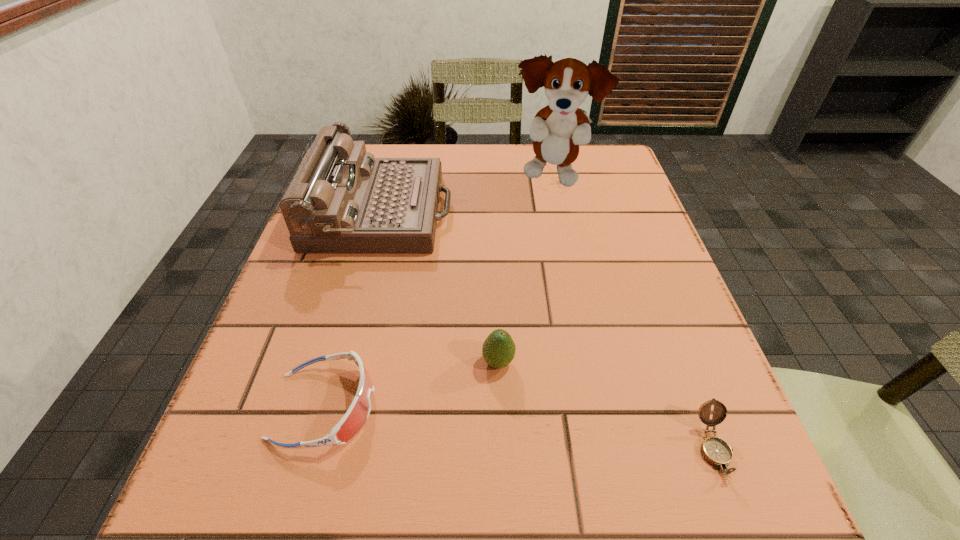
This screenshot has height=540, width=960. Identify the location of vacant space situated on the back of the third object from left to right. (493, 223).

Find the location of a particular element. free spot located on the front-facing side of the goggles is located at coordinates (601, 406).

Locate an element on the screen. The image size is (960, 540). puppy positioned at the far edge is located at coordinates (557, 130).

Locate an element on the screen. This screenshot has width=960, height=540. typewriter located at the far edge is located at coordinates (342, 200).

Locate an element on the screen. This screenshot has height=540, width=960. object situated at the near edge is located at coordinates (716, 451).

I want to click on typewriter situated at the left edge, so click(x=342, y=200).

Where is `goggles that is positioned at the left edge`? This screenshot has height=540, width=960. goggles that is positioned at the left edge is located at coordinates (357, 414).

Identify the location of puppy present at the right edge. (557, 130).

The image size is (960, 540). Identify the location of compass at the right edge. (716, 451).

Find the location of a particular element. The width and height of the screenshot is (960, 540). object located in the far left corner section of the desktop is located at coordinates (342, 200).